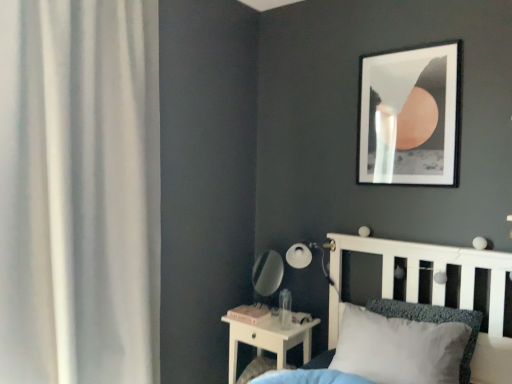
Identify the location of vacant area that is in front of shiny silver mirror at center. The height and width of the screenshot is (384, 512). (281, 322).